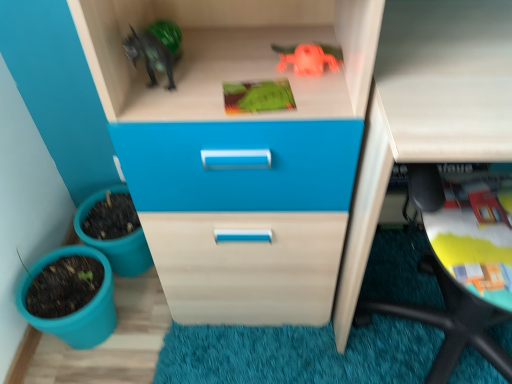
Question: Does matte plastic flowerpot at lower left, which is the 1th flowerpot in bottom-to-top order, appear on the right side of matte white computer desk at lower right?

Choices:
 (A) no
 (B) yes

Answer: (A)

Question: Does matte plastic flowerpot at lower left, which is the 2th flowerpot from top to bottom, touch matte white computer desk at lower right?

Choices:
 (A) yes
 (B) no

Answer: (B)

Question: Considering the relative sizes of matte plastic flowerpot at lower left, which is the 1th flowerpot in bottom-to-top order, and matte white computer desk at lower right in the image provided, is matte plastic flowerpot at lower left, which is the 1th flowerpot in bottom-to-top order, bigger than matte white computer desk at lower right?

Choices:
 (A) yes
 (B) no

Answer: (B)

Question: From a real-world perspective, does matte plastic flowerpot at lower left, which is the 1th flowerpot in bottom-to-top order, sit lower than matte white computer desk at lower right?

Choices:
 (A) yes
 (B) no

Answer: (A)

Question: Is matte plastic flowerpot at lower left, which is the 2th flowerpot from top to bottom, positioned before matte white computer desk at lower right?

Choices:
 (A) no
 (B) yes

Answer: (A)

Question: Is matte plastic flowerpot at lower left, which is the 2th flowerpot from top to bottom, thinner than matte white computer desk at lower right?

Choices:
 (A) no
 (B) yes

Answer: (B)

Question: Is rubber orange toy at upper center, the 1th toy positioned from the top, oriented towards matte white computer desk at lower right?

Choices:
 (A) yes
 (B) no

Answer: (B)

Question: Considering the relative sizes of rubber orange toy at upper center, positioned as the second toy in bottom-to-top order, and matte white computer desk at lower right in the image provided, is rubber orange toy at upper center, positioned as the second toy in bottom-to-top order, smaller than matte white computer desk at lower right?

Choices:
 (A) no
 (B) yes

Answer: (B)

Question: Can you confirm if rubber orange toy at upper center, positioned as the second toy in bottom-to-top order, is thinner than matte white computer desk at lower right?

Choices:
 (A) no
 (B) yes

Answer: (B)

Question: Can you confirm if rubber orange toy at upper center, the 1th toy positioned from the top, is shorter than matte white computer desk at lower right?

Choices:
 (A) yes
 (B) no

Answer: (A)

Question: From a real-world perspective, is rubber orange toy at upper center, the 1th toy positioned from the top, physically above matte white computer desk at lower right?

Choices:
 (A) no
 (B) yes

Answer: (B)

Question: Can you confirm if green matte toy at upper center, positioned as the first toy in bottom-to-top order, is wider than matte white computer desk at lower right?

Choices:
 (A) no
 (B) yes

Answer: (A)